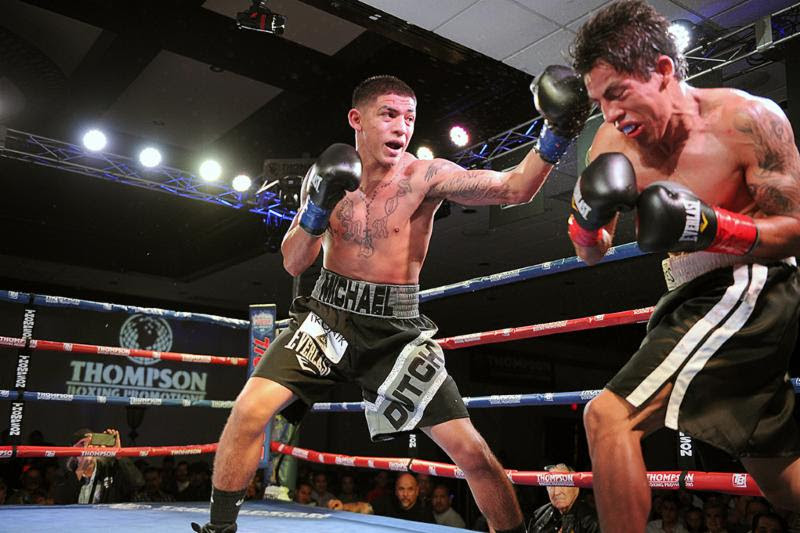
The width and height of the screenshot is (800, 533). Identify the location of white part of ceiling. (526, 35).